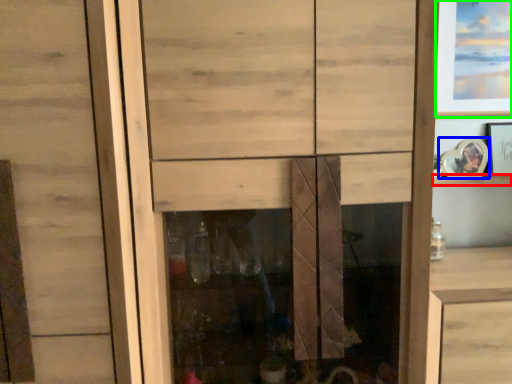
Question: Considering the real-world distances, which object is closest to shelf (highlighted by a red box)? picture frame (highlighted by a blue box) or picture frame (highlighted by a green box).

Choices:
 (A) picture frame
 (B) picture frame

Answer: (A)